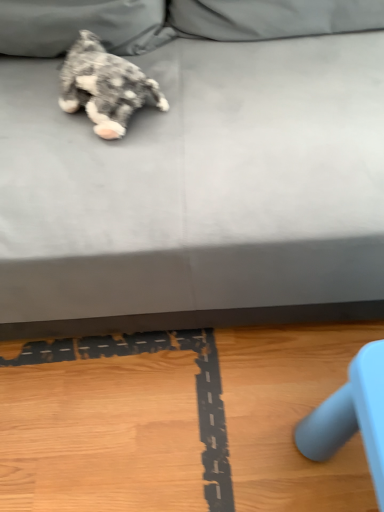
This screenshot has height=512, width=384. I want to click on vacant area to the left of fluffy gray dog at upper left, so click(x=29, y=109).